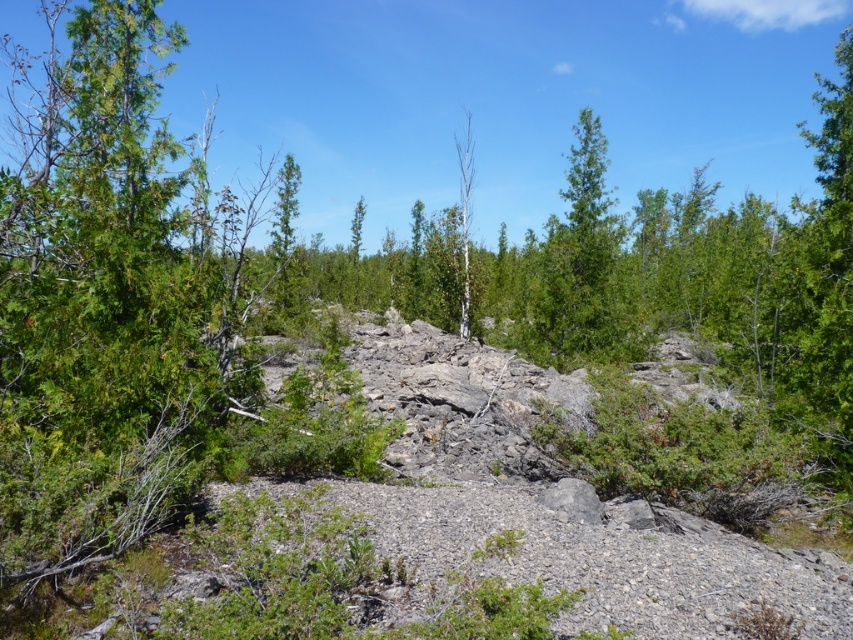
Question: Is green matte tree at center positioned at the back of white smooth tree at center?

Choices:
 (A) no
 (B) yes

Answer: (B)

Question: Among these objects, which one is nearest to the camera?

Choices:
 (A) white smooth tree at center
 (B) green matte tree at center

Answer: (A)

Question: Does green matte tree at center have a greater width compared to white smooth tree at center?

Choices:
 (A) no
 (B) yes

Answer: (B)

Question: Which point is farther from the camera taking this photo?

Choices:
 (A) (459, 323)
 (B) (294, 209)

Answer: (B)

Question: Does green matte tree at center have a smaller size compared to white smooth tree at center?

Choices:
 (A) yes
 (B) no

Answer: (A)